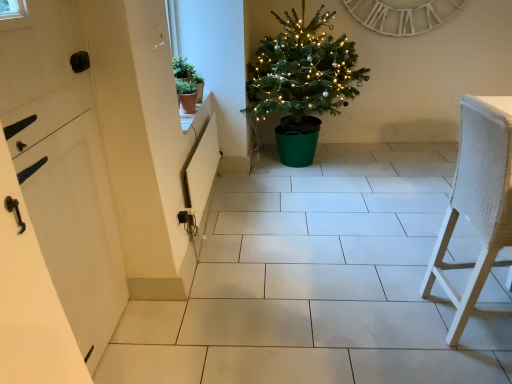
This screenshot has height=384, width=512. I want to click on empty space that is ontop of white wooden clock at upper center (from a real-world perspective), so click(x=393, y=0).